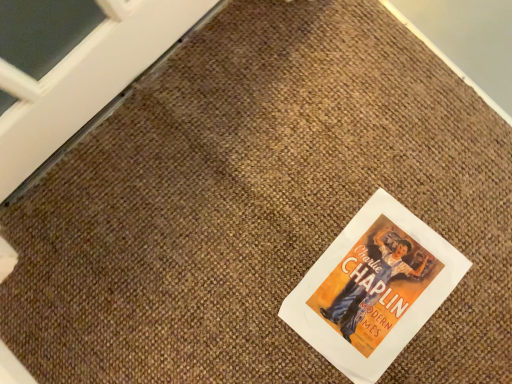
Locate an element on the screen. This screenshot has width=512, height=384. vacant area on top of orange paper poster at center (from a real-world perspective) is located at coordinates (374, 289).